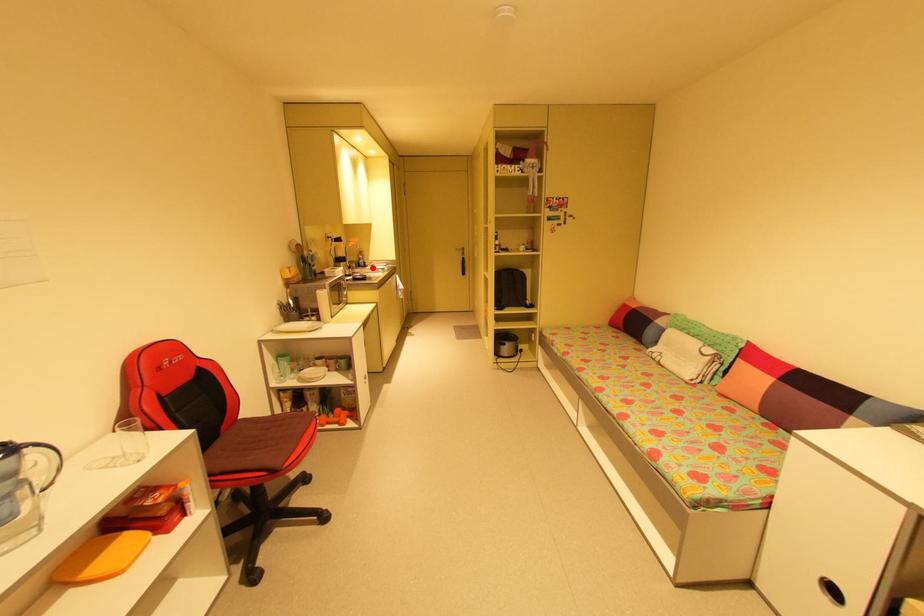
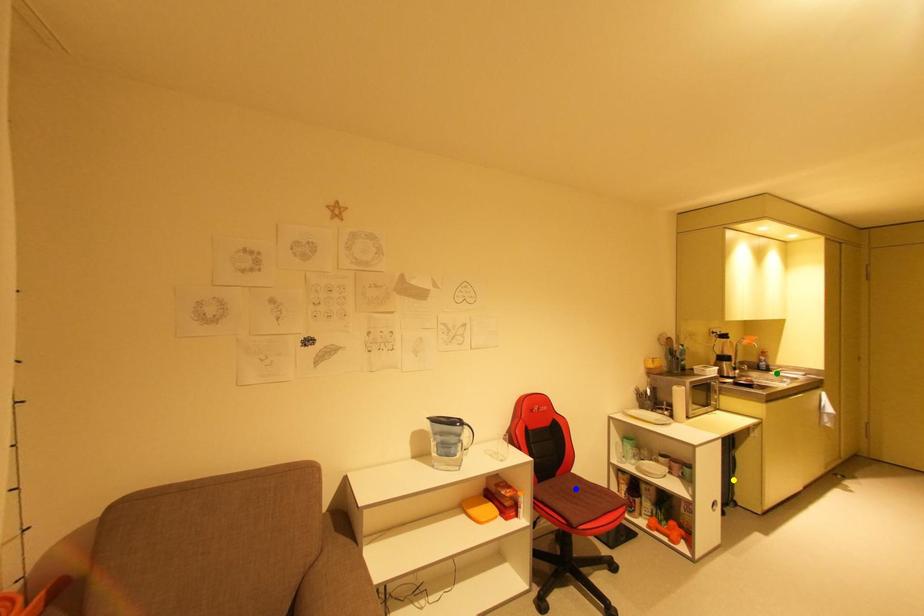
Question: I am providing you with two images of the same scene from different viewpoints. A red point is marked on the first image. You are given multiple points on the second image. Which spot in image 2 lines up with the point in image 1?

Choices:
 (A) green point
 (B) yellow point
 (C) blue point

Answer: (A)